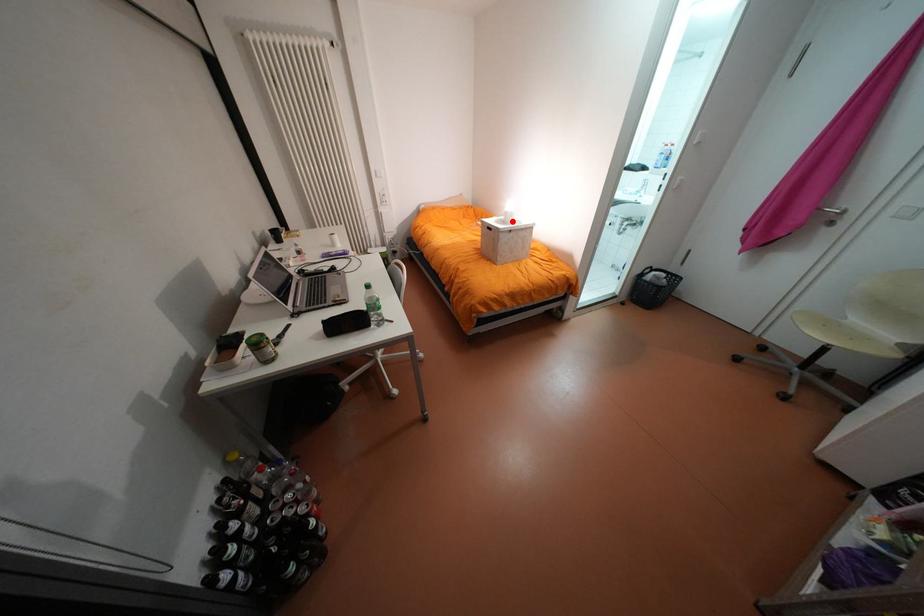
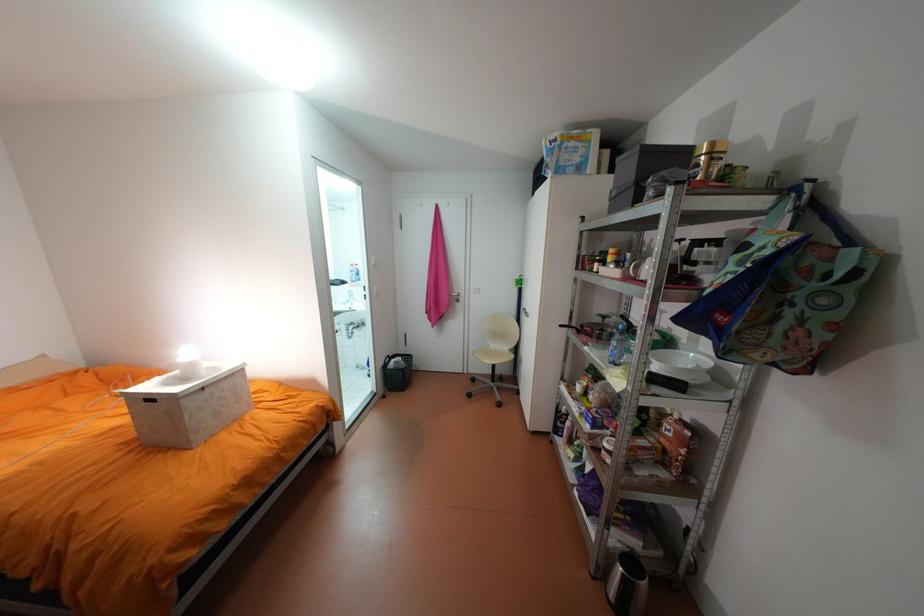
The point at the highlighted location is marked in the first image. Where is the corresponding point in the second image?

(189, 379)